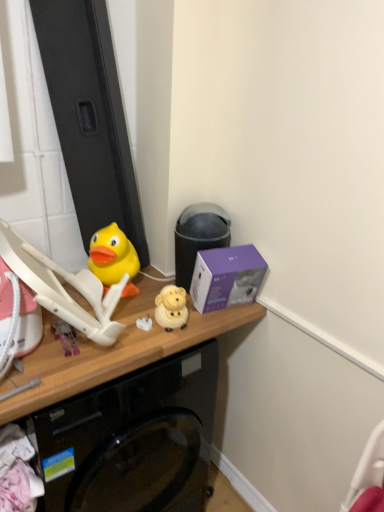
The width and height of the screenshot is (384, 512). Find the location of `vacant area that is situated to the right of white matte plug at center, which is the 2th toy from right to left`. vacant area that is situated to the right of white matte plug at center, which is the 2th toy from right to left is located at coordinates (192, 324).